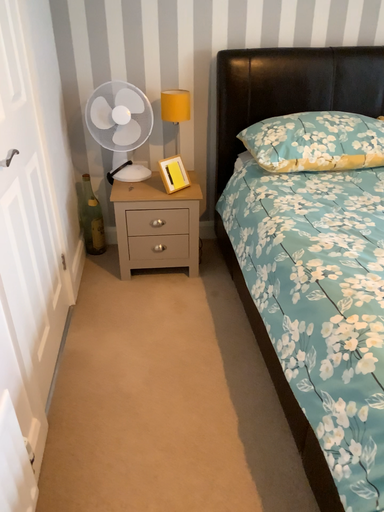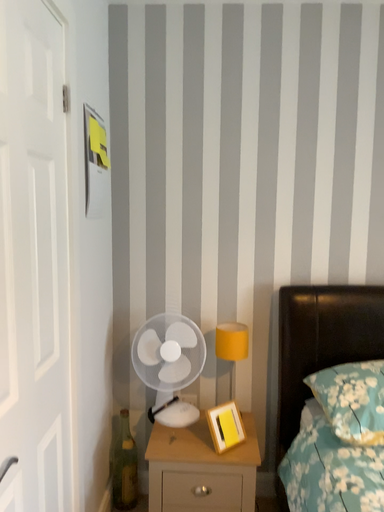
Question: How did the camera likely rotate when shooting the video?

Choices:
 (A) rotated downward
 (B) rotated upward

Answer: (B)